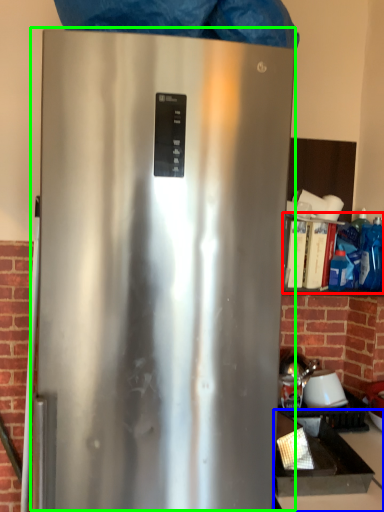
Question: Which object is the farthest from shelf (highlighted by a red box)? Choose among these: counter top (highlighted by a blue box) or refrigerator (highlighted by a green box).

Choices:
 (A) counter top
 (B) refrigerator

Answer: (B)